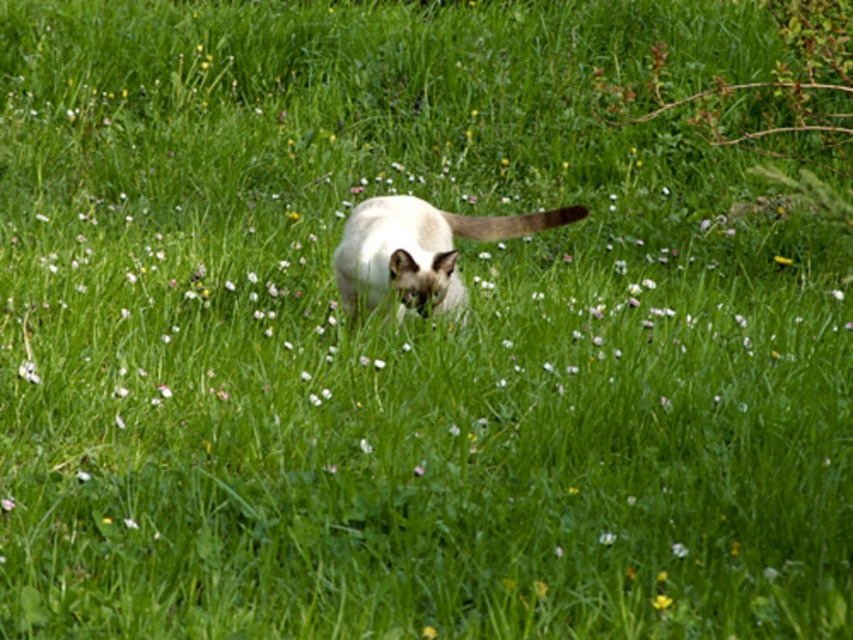
Does white fur cat at center appear over yellow matte flower at lower right?

Yes, white fur cat at center is above yellow matte flower at lower right.

This screenshot has height=640, width=853. Describe the element at coordinates (419, 250) in the screenshot. I see `white fur cat at center` at that location.

At what (x,y) coordinates should I click in order to perform the action: click on white fur cat at center. Please return your answer as a coordinate pair (x, y). The height and width of the screenshot is (640, 853). Looking at the image, I should click on (419, 250).